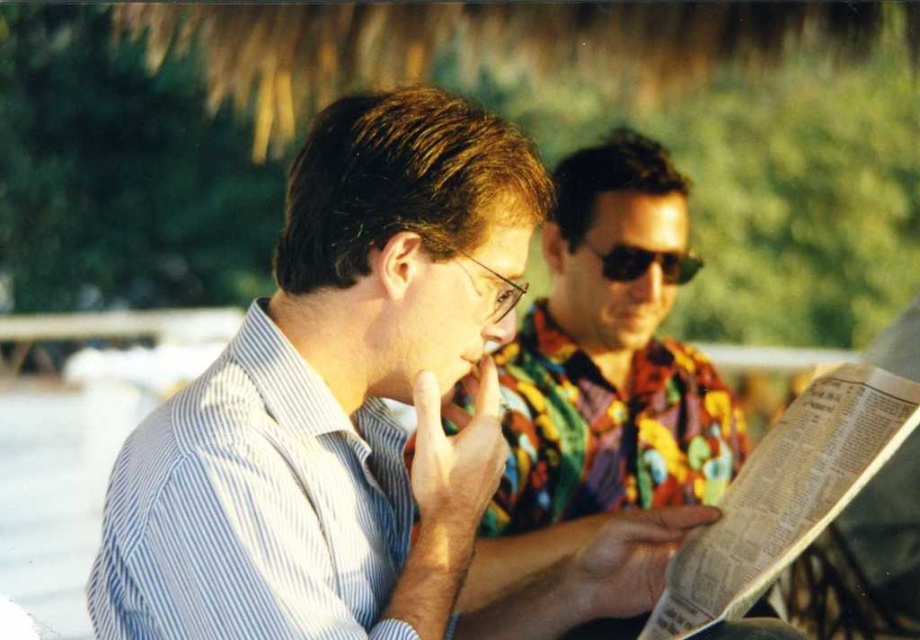
Measure the distance between light blue striped shirt at center and camera.

light blue striped shirt at center and camera are 38.85 inches apart.

Locate an element on the screen. The height and width of the screenshot is (640, 920). light blue striped shirt at center is located at coordinates (332, 397).

What do you see at coordinates (332, 397) in the screenshot? I see `light blue striped shirt at center` at bounding box center [332, 397].

Is point (245, 364) less distant than point (347, 611)?

No, it is not.

Who is more forward, (357, 109) or (101, 540)?

Point (101, 540) is in front.

Image resolution: width=920 pixels, height=640 pixels. I want to click on light blue striped shirt at center, so click(x=332, y=397).

What do you see at coordinates (332, 397) in the screenshot? I see `light blue striped shirt at center` at bounding box center [332, 397].

Between light blue striped shirt at center and multicolored floral shirt at center, which one is positioned lower?

light blue striped shirt at center is lower down.

What do you see at coordinates (332, 397) in the screenshot?
I see `light blue striped shirt at center` at bounding box center [332, 397].

You are a GUI agent. You are given a task and a screenshot of the screen. Output one action in this format:
    pyautogui.click(x=<x>, y=<y>)
    Task: Click on the light blue striped shirt at center
    The image size is (920, 640).
    Given the screenshot: What is the action you would take?
    pyautogui.click(x=332, y=397)